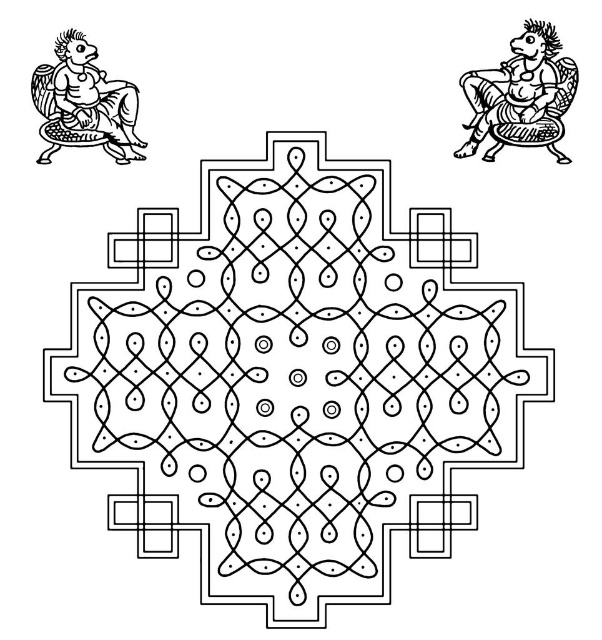
You are an art student analyzing the symmetry of the Kolam design. You notice the black line art figure at upper right and the black ink figure at upper left. Based on their sizes, which figure would appear more prominent in the composition?

The black line art figure at upper right is much taller than the black ink figure at upper left, making it more prominent in the composition.

You are an art conservator examining this traditional Kolam design. You need to determine the spatial relationship between the black line art mandala at center and the black ink figure at upper left. Which object is positioned closer to the viewer?

The black line art mandala at center is closer to the viewer than the black ink figure at upper left.

Based on the scene description, which object is wider, the black line art mandala at center or the black ink figure at upper left?

The black line art mandala at center is wider than the black ink figure at upper left according to the description.